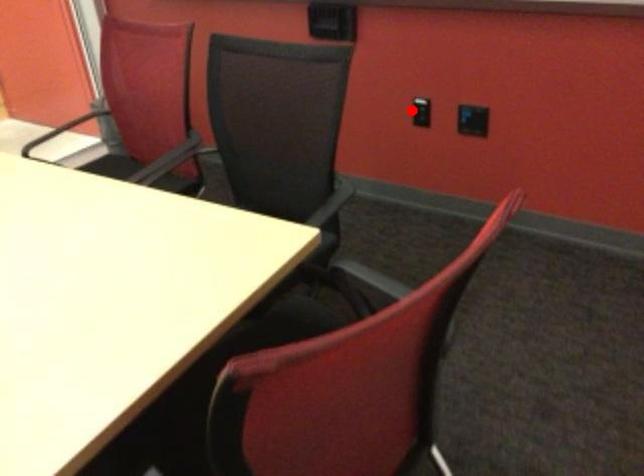
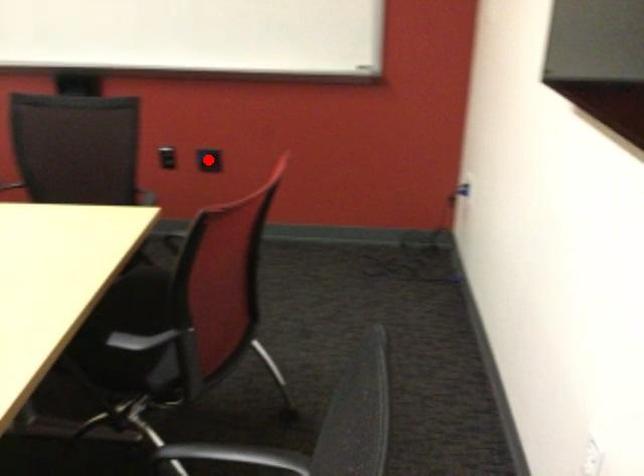
I am providing you with two images of the same scene from different viewpoints. A red point is marked on the first image and another point is marked on the second image. Are the points marked in image1 and image2 representing the same 3D position?

No